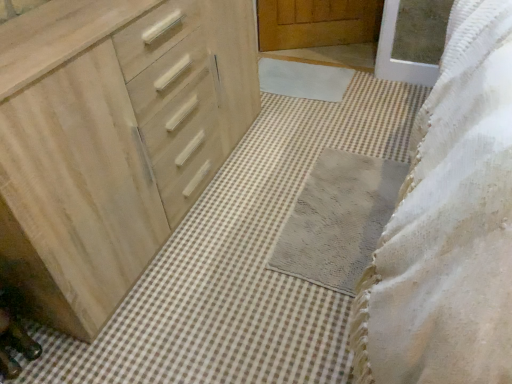
Question: Is white soft bath mat at center, marked as the first bath mat in a back-to-front arrangement, shorter than gray textured bath mat at center, which ranks as the 2th bath mat in top-to-bottom order?

Choices:
 (A) no
 (B) yes

Answer: (A)

Question: Does white soft bath mat at center, marked as the 2th bath mat in a front-to-back arrangement, have a greater height compared to gray textured bath mat at center, which ranks as the 2th bath mat in top-to-bottom order?

Choices:
 (A) no
 (B) yes

Answer: (B)

Question: Can you confirm if white soft bath mat at center, arranged as the second bath mat when ordered from the bottom, is thinner than gray textured bath mat at center, the 1th bath mat from the front?

Choices:
 (A) yes
 (B) no

Answer: (A)

Question: Is white soft bath mat at center, marked as the 2th bath mat in a front-to-back arrangement, positioned with its back to gray textured bath mat at center, which ranks as the 2th bath mat in top-to-bottom order?

Choices:
 (A) yes
 (B) no

Answer: (B)

Question: Is gray textured bath mat at center, which ranks as the 2th bath mat in top-to-bottom order, inside white soft bath mat at center, arranged as the second bath mat when ordered from the bottom?

Choices:
 (A) no
 (B) yes

Answer: (A)

Question: Is point (290, 61) closer or farther from the camera than point (56, 168)?

Choices:
 (A) closer
 (B) farther

Answer: (B)

Question: Relative to natural wood chest of drawers at left, is white soft bath mat at center, arranged as the second bath mat when ordered from the bottom, in front or behind?

Choices:
 (A) behind
 (B) front

Answer: (A)

Question: In terms of width, does white soft bath mat at center, marked as the 2th bath mat in a front-to-back arrangement, look wider or thinner when compared to natural wood chest of drawers at left?

Choices:
 (A) wide
 (B) thin

Answer: (A)

Question: Considering the positions of white soft bath mat at center, marked as the first bath mat in a back-to-front arrangement, and natural wood chest of drawers at left in the image, is white soft bath mat at center, marked as the first bath mat in a back-to-front arrangement, bigger or smaller than natural wood chest of drawers at left?

Choices:
 (A) small
 (B) big

Answer: (A)

Question: From the image's perspective, is gray textured bath mat at center, the 1th bath mat when ordered from bottom to top, positioned above or below white soft bath mat at center, marked as the 2th bath mat in a front-to-back arrangement?

Choices:
 (A) below
 (B) above

Answer: (A)

Question: Considering the relative positions of gray textured bath mat at center, the 2th bath mat positioned from the back, and white soft bath mat at center, marked as the 2th bath mat in a front-to-back arrangement, in the image provided, is gray textured bath mat at center, the 2th bath mat positioned from the back, to the left or to the right of white soft bath mat at center, marked as the 2th bath mat in a front-to-back arrangement,?

Choices:
 (A) right
 (B) left

Answer: (A)

Question: Looking at their shapes, would you say gray textured bath mat at center, which ranks as the 2th bath mat in top-to-bottom order, is wider or thinner than white soft bath mat at center, arranged as the second bath mat when ordered from the bottom?

Choices:
 (A) thin
 (B) wide

Answer: (B)

Question: Does point (385, 178) appear closer or farther from the camera than point (275, 62)?

Choices:
 (A) farther
 (B) closer

Answer: (B)

Question: Considering their positions, is white soft bath mat at center, marked as the first bath mat in a back-to-front arrangement, located in front of or behind gray textured bath mat at center, the 1th bath mat when ordered from bottom to top?

Choices:
 (A) front
 (B) behind

Answer: (B)

Question: Is white soft bath mat at center, marked as the 2th bath mat in a front-to-back arrangement, wider or thinner than gray textured bath mat at center, the 1th bath mat from the front?

Choices:
 (A) thin
 (B) wide

Answer: (A)